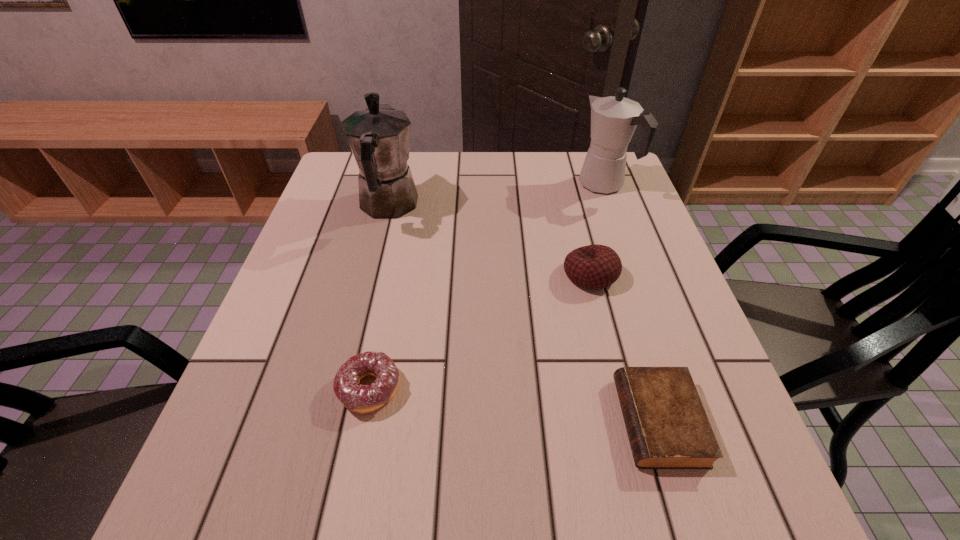
You are a GUI agent. You are given a task and a screenshot of the screen. Output one action in this format:
    pyautogui.click(x=<x>, y=<y>)
    Task: Click on the vacant space situated on the back of the third tallest object
    The width and height of the screenshot is (960, 540).
    Given the screenshot: What is the action you would take?
    pyautogui.click(x=570, y=193)

This screenshot has height=540, width=960. I want to click on free space located on the right of the second shortest object, so click(624, 388).

Find the location of `blank space located 0.060m on the spine side of the shortest object`. blank space located 0.060m on the spine side of the shortest object is located at coordinates (586, 421).

Identify the location of free space located 0.300m on the spine side of the shortest object. (444, 421).

Locate an element on the screen. The width and height of the screenshot is (960, 540). free region located on the spine side of the shortest object is located at coordinates (580, 421).

Locate an element on the screen. The width and height of the screenshot is (960, 540). object present at the near edge is located at coordinates (667, 426).

Identify the location of object at the left edge. (379, 137).

Where is `coffeepot that is at the right edge`? This screenshot has height=540, width=960. coffeepot that is at the right edge is located at coordinates (613, 119).

You are a GUI agent. You are given a task and a screenshot of the screen. Output one action in this format:
    pyautogui.click(x=<x>, y=<y>)
    Task: Click on the beanbag at the right edge
    The image size is (960, 540).
    Given the screenshot: What is the action you would take?
    pyautogui.click(x=595, y=266)

At what (x,y) coordinates should I click in order to perform the action: click on diary present at the right edge. Please return your answer as a coordinate pair (x, y). This screenshot has height=540, width=960. Looking at the image, I should click on (667, 426).